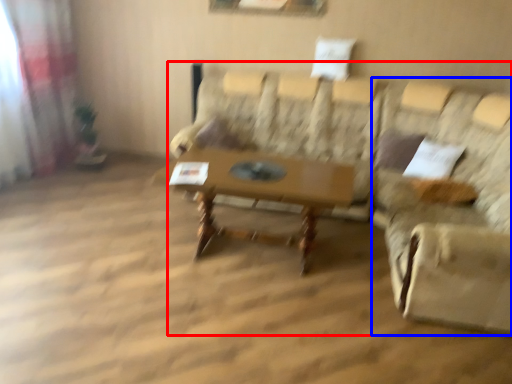
Question: Among these objects, which one is farthest to the camera, studio couch (highlighted by a red box) or swivel chair (highlighted by a blue box)?

Choices:
 (A) studio couch
 (B) swivel chair

Answer: (B)